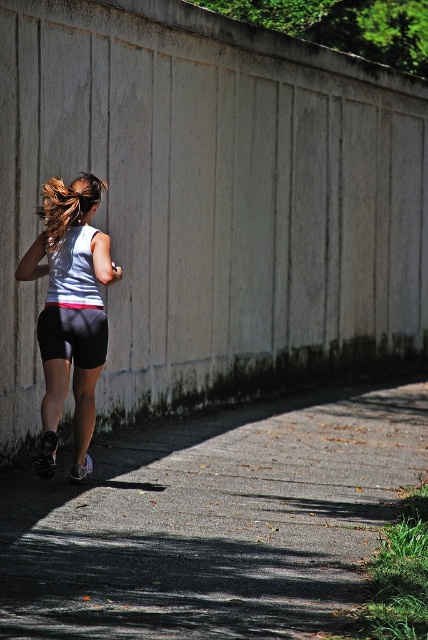
Is gray asphalt pavement at lower center smaller than gray matte shorts at center?

No.

Is gray asphalt pavement at lower center positioned in front of gray matte shorts at center?

Yes, it is.

Does point (235, 499) lie in front of point (91, 330)?

No, it is not.

You are a GUI agent. You are given a task and a screenshot of the screen. Output one action in this format:
    pyautogui.click(x=<x>, y=<y>)
    Task: Click on the gray asphalt pavement at lower center
    
    Given the screenshot: What is the action you would take?
    pyautogui.click(x=213, y=522)

Consider the image. Who is higher up, gray asphalt pavement at lower center or blonde hair at back?

Positioned higher is blonde hair at back.

The height and width of the screenshot is (640, 428). In order to click on gray asphalt pavement at lower center in this screenshot , I will do `click(213, 522)`.

Image resolution: width=428 pixels, height=640 pixels. Identify the location of gray asphalt pavement at lower center. (213, 522).

This screenshot has height=640, width=428. What are the coordinates of `gray asphalt pavement at lower center` in the screenshot? It's located at (213, 522).

Can you confirm if white matte shorts at center is smaller than gray matte shorts at center?

No, white matte shorts at center is not smaller than gray matte shorts at center.

Is white matte shorts at center shorter than gray matte shorts at center?

Incorrect, white matte shorts at center's height does not fall short of gray matte shorts at center's.

Who is more distant from viewer, (89,458) or (65,339)?

The point (89,458) is behind.

Locate an element on the screen. This screenshot has height=640, width=428. white matte shorts at center is located at coordinates (71, 310).